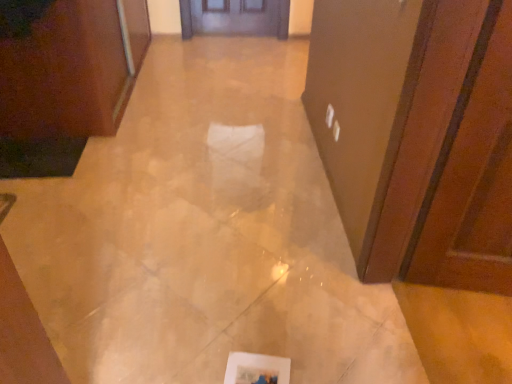
This screenshot has width=512, height=384. Find the location of `blank space to the left of wooden door at right`. blank space to the left of wooden door at right is located at coordinates (341, 318).